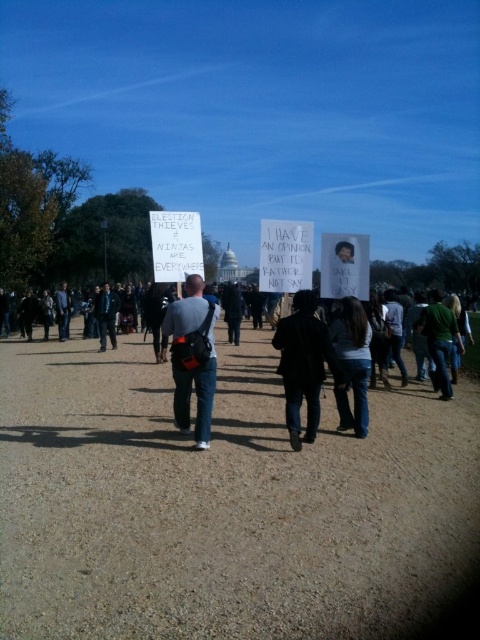
You are a photographer trying to capture the protest scene. You notice two items at the center of the image. Which item is positioned to the right of the other? The items are dark gray jeans at center and gray fabric backpack at center.

The dark gray jeans at center are to the right of the gray fabric backpack at center.

You are a photographer trying to capture a clear shot of both the green fabric shirt at center and the dark blue shirt at center. Since you can only focus on one subject at a time, which shirt should you focus on to ensure the other remains in the background?

You should focus on the green fabric shirt at center because it is in front of the dark blue shirt at center, so if you focus on the green one, the dark blue shirt will be in the background and still somewhat visible.

You are a photographer trying to capture a clear shot of both the green fabric shirt at center and the dark blue shirt at center. Since you want to ensure both are fully visible in the frame, which shirt should you focus on to account for their sizes?

The green fabric shirt at center is taller than the dark blue shirt at center. To ensure both are fully visible, focus on the green fabric shirt at center as it requires more vertical space in the frame.